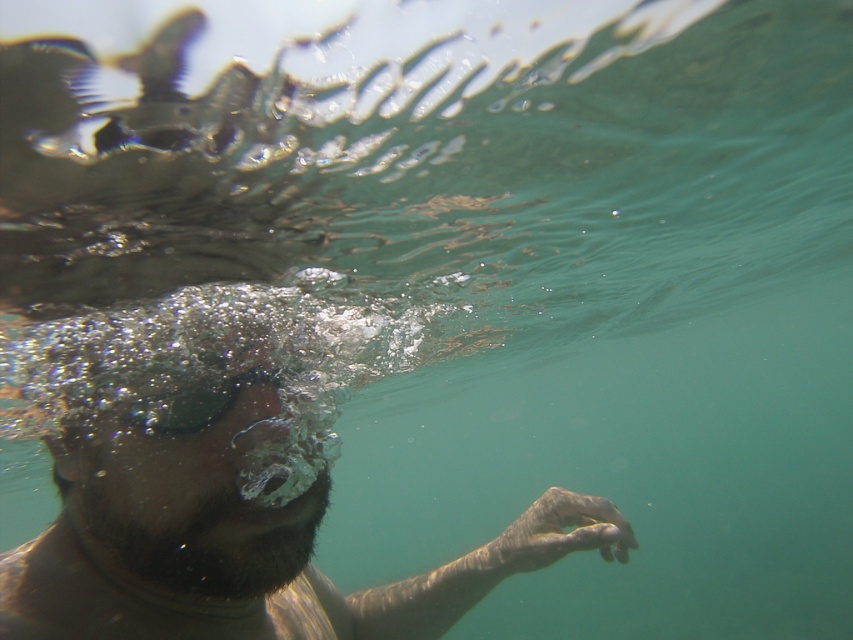
You are a marine biologist studying underwater movements. You observe the brown matte skin at center in the image. Can you determine its exact location using coordinates?

The brown matte skin at center is located at coordinates point (230, 488).

From the picture: You are a scuba diver planning to place a marker at point A and point B underwater. The coordinates for point A are at the swimmer and point B are at point (280, 625). If the minimum distance required between markers is 5 feet, can you place both markers?

The swimmer and point (280, 625) are 5.68 feet apart, so yes, you can place both markers since the distance between them meets the minimum requirement of 5 feet.

You are a photographer trying to capture a closeup shot of the brown matte skin at center underwater. The camera you are using has a maximum focus range of 4 feet. Will you be able to take the photo without moving closer?

The distance of brown matte skin at center from camera is 4.21 feet, which is slightly beyond the camera maximum focus range of 4 feet. You need to move closer to take the photo.